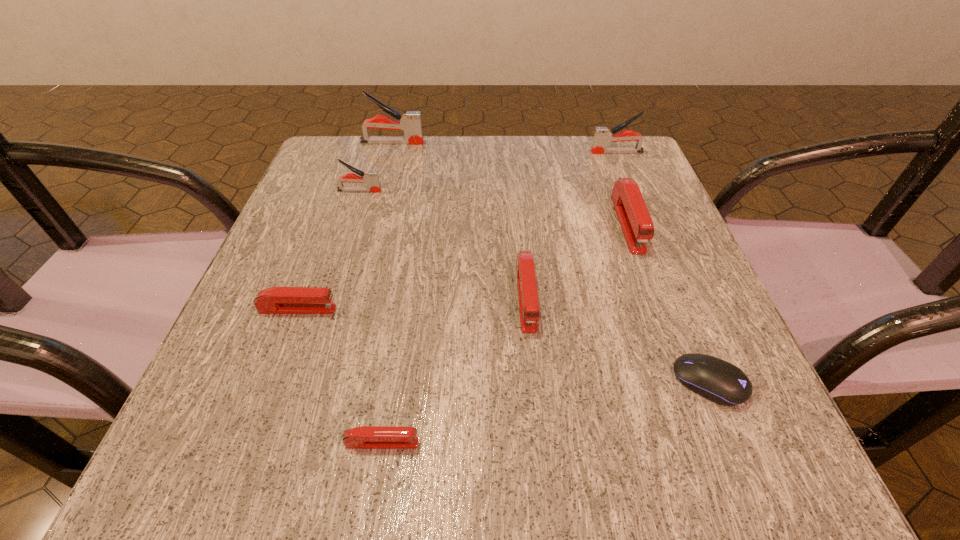
Where is `the second smallest red stapler`? The image size is (960, 540). the second smallest red stapler is located at coordinates (275, 300).

You are a GUI agent. You are given a task and a screenshot of the screen. Output one action in this format:
    pyautogui.click(x=<x>, y=<y>)
    Task: Click on the second shortest stapler
    
    Given the screenshot: What is the action you would take?
    pyautogui.click(x=275, y=300)

The image size is (960, 540). Identify the location of the nearest object. (365, 437).

Image resolution: width=960 pixels, height=540 pixels. I want to click on the nearest stapler, so (365, 437).

Locate an element on the screen. Image resolution: width=960 pixels, height=540 pixels. black computer mouse is located at coordinates (719, 381).

This screenshot has width=960, height=540. Find the location of `the seventh farthest object`. the seventh farthest object is located at coordinates (719, 381).

The height and width of the screenshot is (540, 960). Identify the location of free region located 0.400m on the handle side of the farthest stapler. (589, 143).

The width and height of the screenshot is (960, 540). I want to click on vacant space located 0.220m on the handle side of the second nearest gray stapler, so click(497, 152).

This screenshot has width=960, height=540. I want to click on vacant space located 0.070m on the handle side of the second nearest gray stapler, so click(562, 152).

Locate an element on the screen. The width and height of the screenshot is (960, 540). vacant area located on the handle side of the second nearest gray stapler is located at coordinates (510, 152).